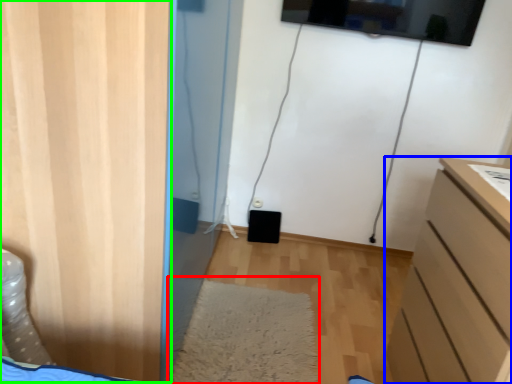
Question: Which object is the farthest from mat (highlighted by a red box)? Choose among these: chest of drawers (highlighted by a blue box) or door (highlighted by a green box).

Choices:
 (A) chest of drawers
 (B) door

Answer: (B)